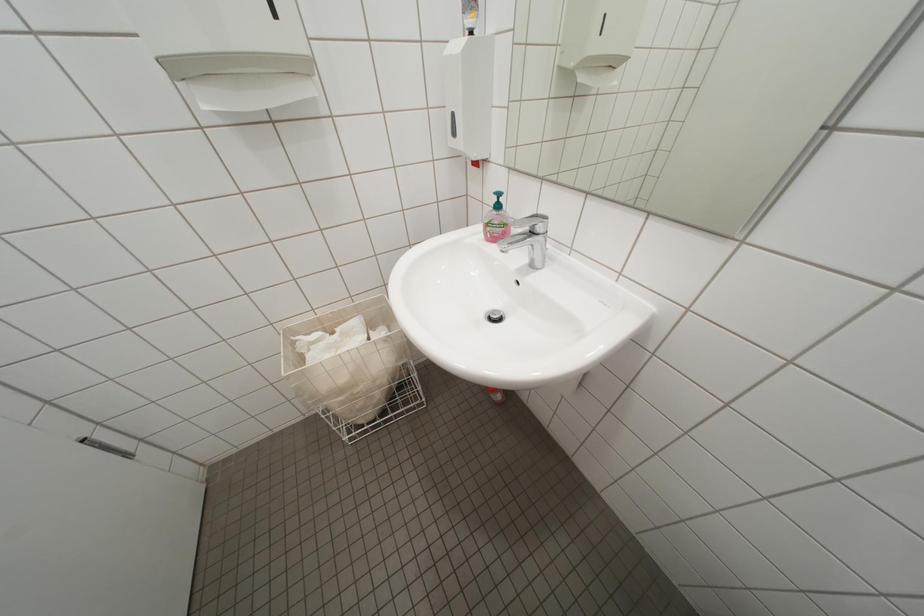
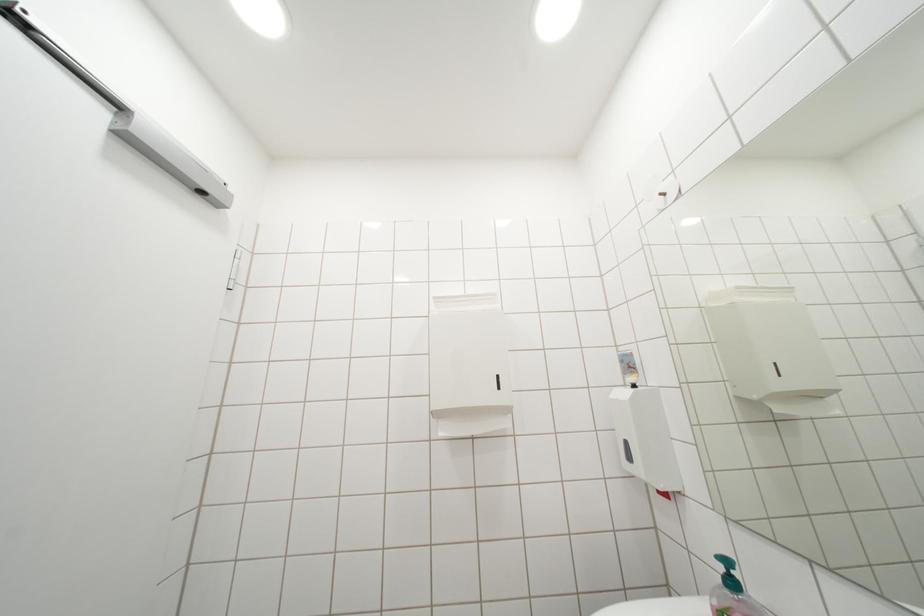
The first image is from the beginning of the video and the second image is from the end. How did the camera likely rotate when shooting the video?

The camera's rotation is toward left-up.